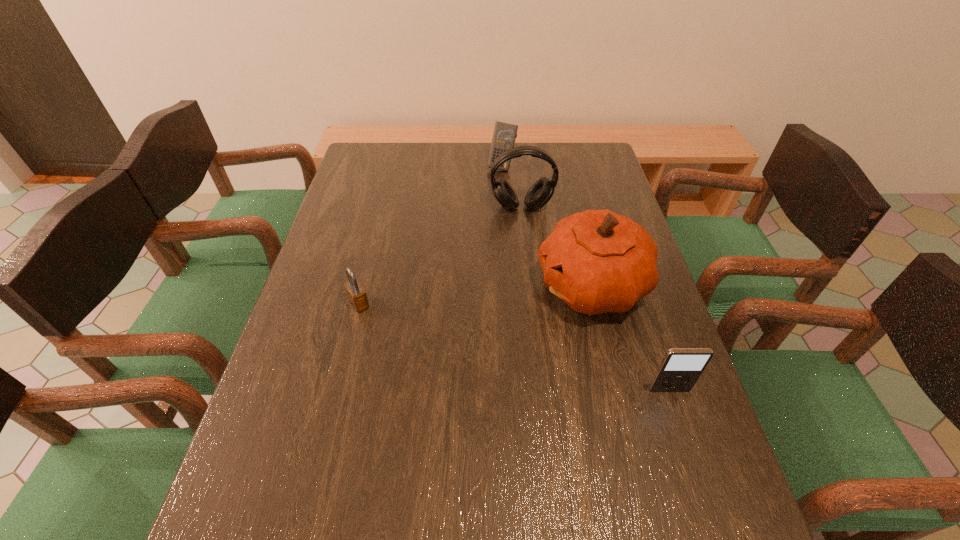
Where is `free space located on the front-facing side of the pumpkin`? free space located on the front-facing side of the pumpkin is located at coordinates (511, 313).

Identify the location of vacant position located on the front-facing side of the calculator. The height and width of the screenshot is (540, 960). (489, 218).

You are a GUI agent. You are given a task and a screenshot of the screen. Output one action in this format:
    pyautogui.click(x=<x>, y=<y>)
    Task: Click on the vacant area located 0.180m on the front-facing side of the calculator
    This screenshot has width=960, height=540.
    Given the screenshot: What is the action you would take?
    pyautogui.click(x=492, y=204)

You are a GUI agent. You are given a task and a screenshot of the screen. Output one action in this format:
    pyautogui.click(x=<x>, y=<y>)
    Task: Click on the free space located on the front-facing side of the calculator
    The width and height of the screenshot is (960, 540).
    Given the screenshot: What is the action you would take?
    pyautogui.click(x=492, y=206)

Find the location of a particular element. free location located 0.230m on the earcups of the headset is located at coordinates (531, 268).

At what (x,y) coordinates should I click in order to perform the action: click on blank area located 0.260m on the earcups of the headset. Please return your answer as a coordinate pair (x, y). Looking at the image, I should click on (x=532, y=276).

Locate an element on the screen. This screenshot has width=960, height=540. vacant space situated on the earcups of the headset is located at coordinates (525, 230).

Locate an element on the screen. This screenshot has width=960, height=540. object that is at the far edge is located at coordinates (504, 135).

At what (x,y) coordinates should I click in order to perform the action: click on object at the left edge. Please return your answer as a coordinate pair (x, y). Looking at the image, I should click on (356, 294).

Where is `iPod present at the right edge`? This screenshot has width=960, height=540. iPod present at the right edge is located at coordinates pos(680,369).